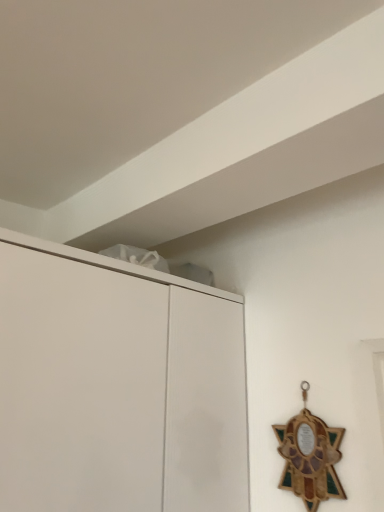
Question: Should I look upward or downward to see wooden stained glass star at upper right?

Choices:
 (A) down
 (B) up

Answer: (A)